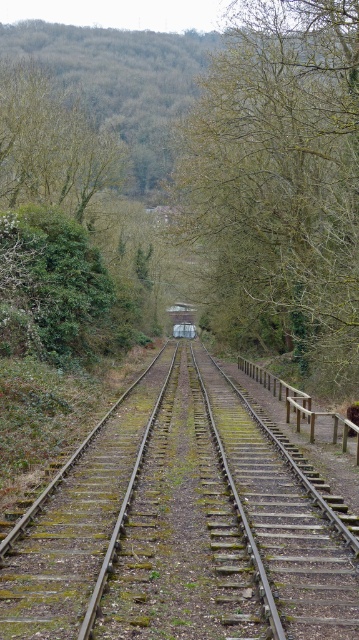
Question: Is green leafy tree at center behind metallic silver train at center?

Choices:
 (A) no
 (B) yes

Answer: (A)

Question: Estimate the real-world distances between objects in this image. Which object is closer to the green leafy tree at upper center?

Choices:
 (A) metallic silver train at center
 (B) green leafy tree at center
 (C) green mossy metal track at center

Answer: (B)

Question: Estimate the real-world distances between objects in this image. Which object is closer to the green leafy tree at upper center?

Choices:
 (A) green leafy tree at center
 (B) green mossy metal track at center
 (C) metallic silver train at center

Answer: (A)

Question: Considering the real-world distances, which object is farthest from the green mossy metal track at center?

Choices:
 (A) metallic silver train at center
 (B) green leafy tree at upper center
 (C) green leafy tree at center

Answer: (A)

Question: Is green leafy tree at upper center below metallic silver train at center?

Choices:
 (A) yes
 (B) no

Answer: (B)

Question: Can you confirm if green leafy tree at center is positioned below green leafy tree at upper center?

Choices:
 (A) yes
 (B) no

Answer: (A)